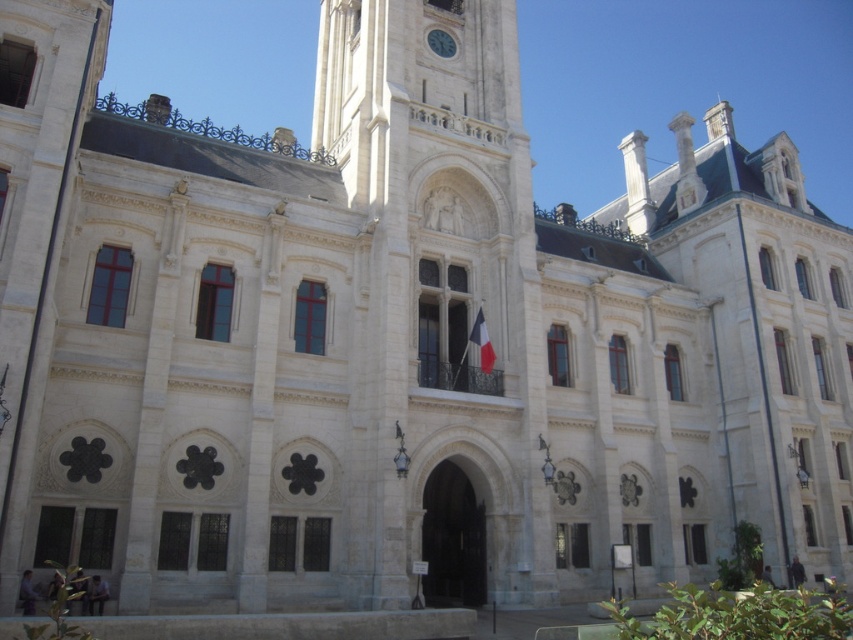
You are an architect designing a new building inspired by this historic structure. The flagpole for the polished fabric flag at center must be positioned so it doesn not block the view of the white stone clock at upper center. Given their sizes, which object should be placed higher to ensure visibility?

The white stone clock at upper center is wider than the polished fabric flag at center, so placing the clock higher will ensure it remains visible without obstruction from the thinner flagpole.

You are standing in front of the historic building and notice the polished fabric flag at center. Based on its position, can you determine if it is placed above or below the central arched entrance?

The polished fabric flag at center is located at point coordinates that place it above the central arched entrance.

You are a tour guide explaining the exterior of this historic building to visitors. You want to mention both the polished fabric flag at center and the white stone clock at upper center. Which object is bigger in size?

The polished fabric flag at center is larger in size compared to the white stone clock at upper center.